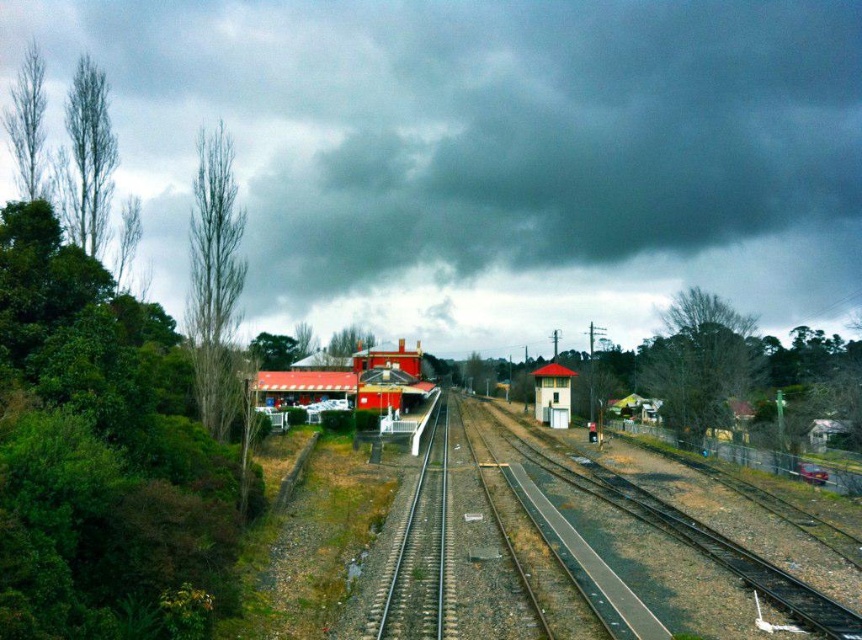
Question: Is green asphalt track at center below white plastic building at center?

Choices:
 (A) yes
 (B) no

Answer: (A)

Question: Based on their relative distances, which object is nearer to the white plastic building at center?

Choices:
 (A) matte brick building at center
 (B) dark gray cloud at upper center
 (C) green asphalt track at center

Answer: (A)

Question: Which object is farther from the camera taking this photo?

Choices:
 (A) green asphalt track at center
 (B) matte brick building at center
 (C) dark gray cloud at upper center

Answer: (C)

Question: Does matte brick building at center have a lesser width compared to white plastic building at center?

Choices:
 (A) yes
 (B) no

Answer: (B)

Question: Which object appears farthest from the camera in this image?

Choices:
 (A) matte brick building at center
 (B) dark gray cloud at upper center
 (C) white plastic building at center

Answer: (C)

Question: Can you confirm if dark gray cloud at upper center is wider than green asphalt track at center?

Choices:
 (A) no
 (B) yes

Answer: (B)